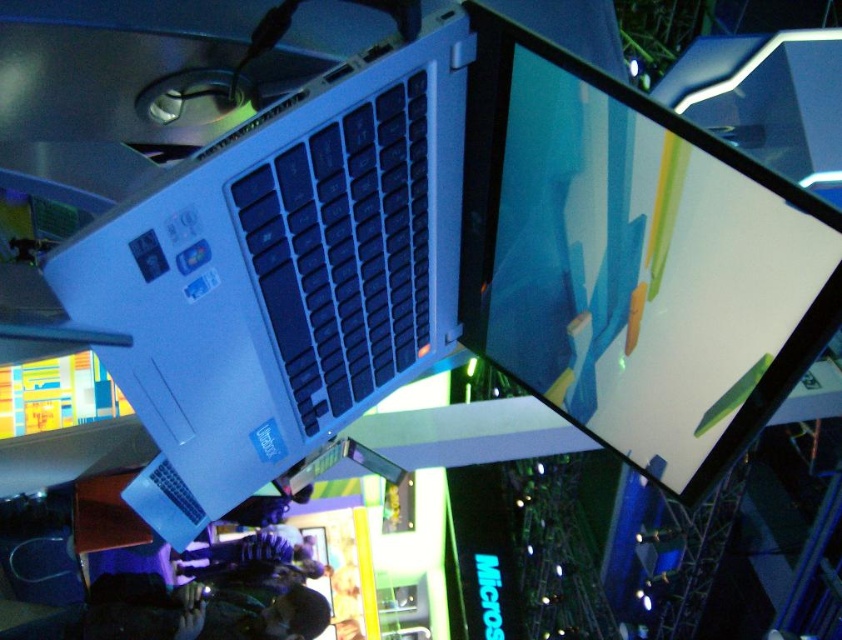
In the scene shown: Between satin white laptop at upper center and matte black screen at upper center, which one is positioned lower?

matte black screen at upper center is lower down.

Does satin white laptop at upper center have a larger size compared to matte black screen at upper center?

Indeed, satin white laptop at upper center has a larger size compared to matte black screen at upper center.

Describe the element at coordinates (283, 273) in the screenshot. I see `satin white laptop at upper center` at that location.

Where is `satin white laptop at upper center`? The width and height of the screenshot is (842, 640). satin white laptop at upper center is located at coordinates (283, 273).